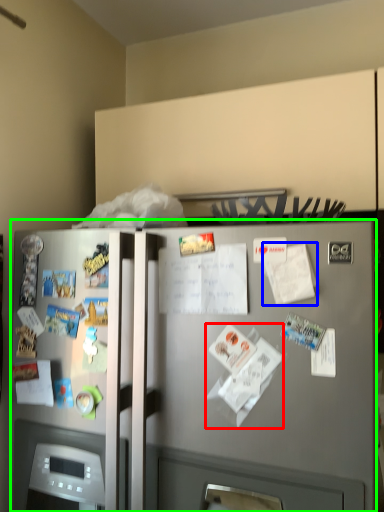
Question: Based on their relative distances, which object is nearer to paper (highlighted by a red box)? Choose from paper (highlighted by a blue box) and refrigerator (highlighted by a green box).

Choices:
 (A) paper
 (B) refrigerator

Answer: (A)